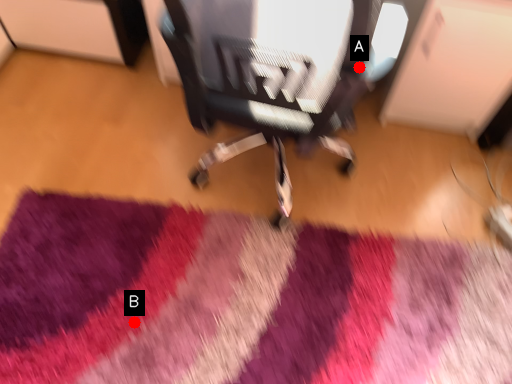
Question: Two points are circled on the image, labeled by A and B beside each circle. Which point is farther to the camera?

Choices:
 (A) A is further
 (B) B is further

Answer: (B)